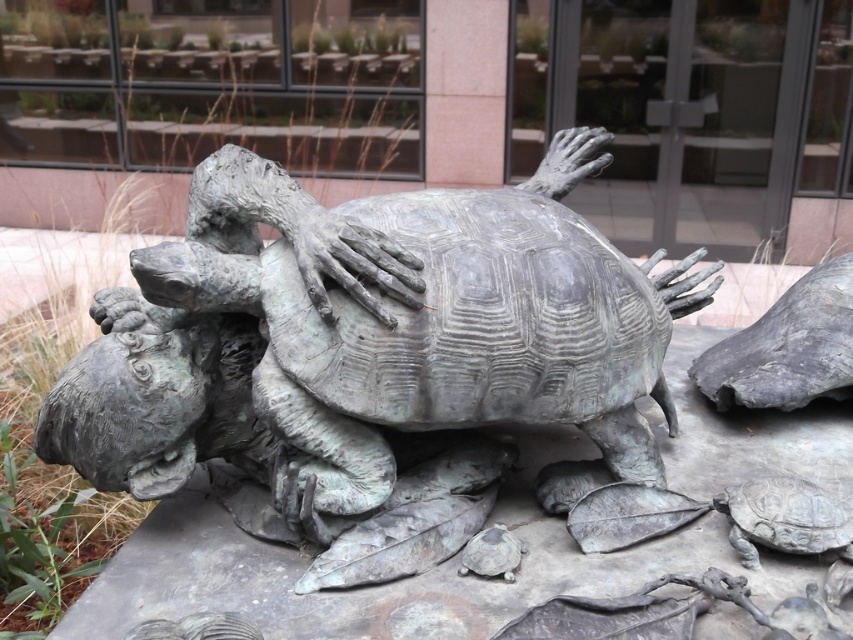
From the picture: Can you confirm if bronze textured tortoise at center is smaller than bronze textured tortoise at lower right?

No.

Which is in front, point (428, 257) or point (776, 522)?

Point (776, 522) is more forward.

Which is in front, point (657, 317) or point (749, 554)?

Point (749, 554)

The width and height of the screenshot is (853, 640). In order to click on bronze textured tortoise at center in this screenshot , I will do `click(426, 316)`.